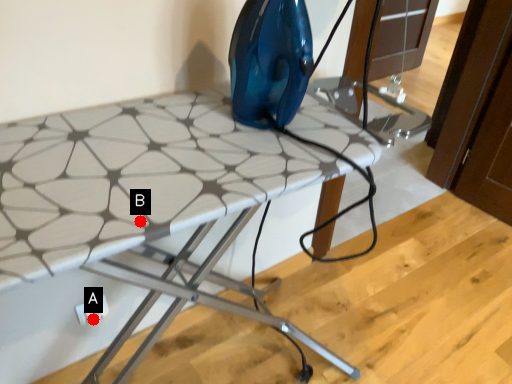
Question: Two points are circled on the image, labeled by A and B beside each circle. Which point is further to the camera?

Choices:
 (A) A is further
 (B) B is further

Answer: (A)